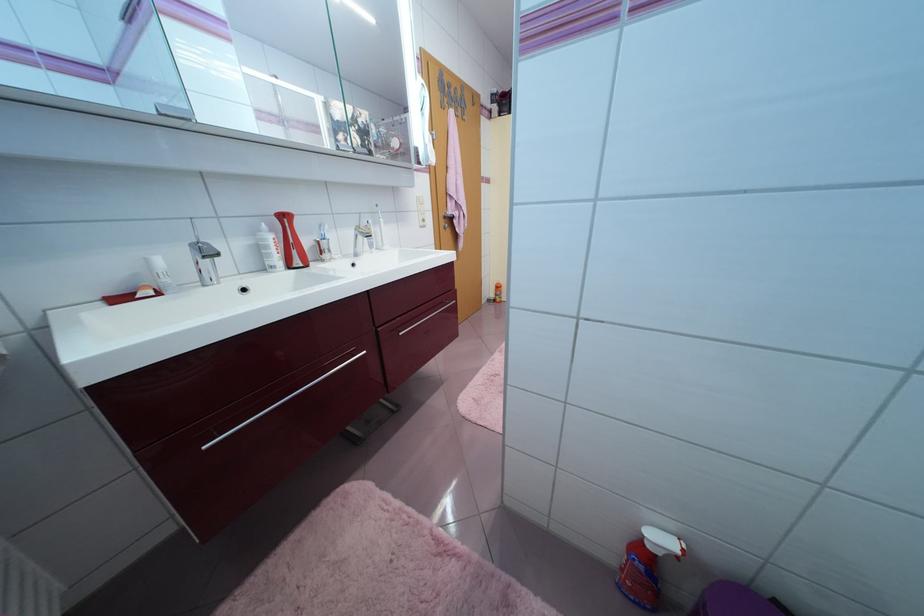
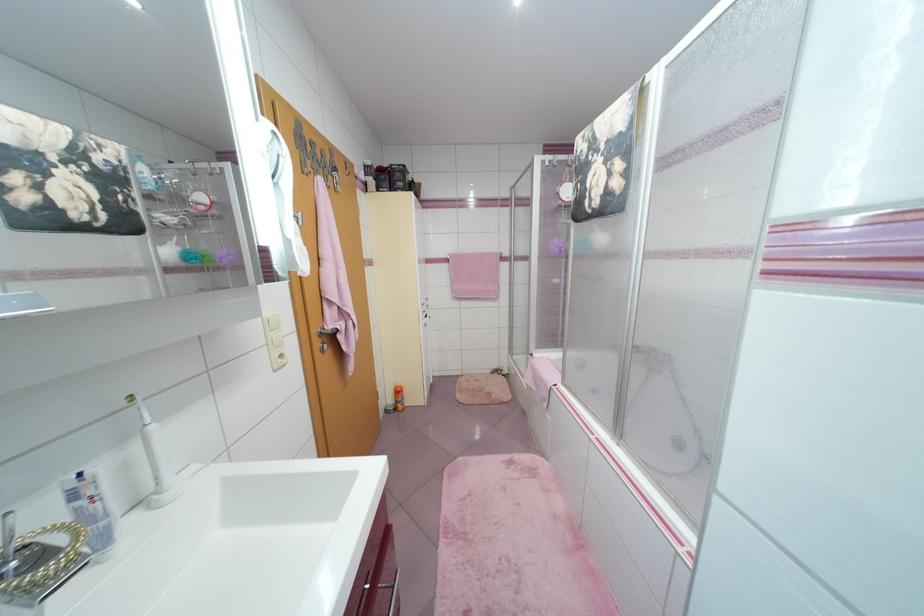
Question: How did the camera likely rotate?

Choices:
 (A) Left
 (B) Right
 (C) Up
 (D) Down

Answer: (B)